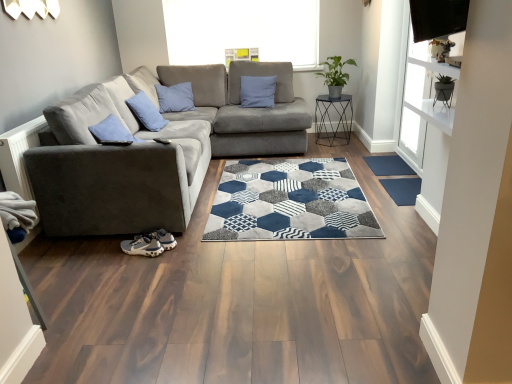
What is the approximate height of blue fabric pillow at center?

blue fabric pillow at center is 15.41 inches in height.

Describe the element at coordinates (434, 36) in the screenshot. I see `transparent glass window screen at upper right` at that location.

Find the location of a particular element. The width and height of the screenshot is (512, 384). blue textured mat at right, which appears as the 1th doormat when ordered from the bottom is located at coordinates (402, 190).

What do you see at coordinates (143, 246) in the screenshot?
I see `gray suede sneaker at lower left` at bounding box center [143, 246].

Locate an element on the screen. The image size is (512, 384). metallic black side table at center is located at coordinates (333, 120).

Does point (395, 171) appear closer or farther from the camera than point (331, 58)?

Clearly, point (395, 171) is closer to the camera than point (331, 58).

Could you measure the distance between dark blue rubber mat at lower right, the 1th doormat viewed from the top, and green matte plant at upper right?

dark blue rubber mat at lower right, the 1th doormat viewed from the top, is 4.15 feet away from green matte plant at upper right.

You are a GUI agent. You are given a task and a screenshot of the screen. Output one action in this format:
    pyautogui.click(x=<x>, y=<y>)
    Task: Click on the plant that is above the dark blue rubber mat at lower right, the 1th doormat viewed from the top (from the image's perspective)
    
    Given the screenshot: What is the action you would take?
    pyautogui.click(x=335, y=75)

Locate an element on the screen. This screenshot has width=512, height=384. pillow that appears above the blue textured mat at right, positioned as the second doormat in top-to-bottom order (from the image's perspective) is located at coordinates (146, 112).

Based on the photo, from a real-world perspective, is blue fabric pillow at center located higher than blue textured mat at right, the 2th doormat when ordered from back to front?

Yes, from a real-world perspective, blue fabric pillow at center is on top of blue textured mat at right, the 2th doormat when ordered from back to front.

Can you confirm if gray fabric couch at left is shorter than green matte plant at upper right?

No.

Can you confirm if gray fabric couch at left is smaller than green matte plant at upper right?

No.

Does gray fabric couch at left lie in front of green matte plant at upper right?

Yes, the depth of gray fabric couch at left is less than that of green matte plant at upper right.

Is gray fabric couch at left far from green matte plant at upper right?

Yes, gray fabric couch at left and green matte plant at upper right are quite far apart.

Which of these two, blue fabric pillow at center or metallic black side table at center, stands shorter?

blue fabric pillow at center.

This screenshot has height=384, width=512. Identify the location of pillow that appears in front of the metallic black side table at center. (146, 112).

Consider the image. Considering the relative sizes of blue fabric pillow at center and metallic black side table at center in the image provided, is blue fabric pillow at center thinner than metallic black side table at center?

Indeed, blue fabric pillow at center has a lesser width compared to metallic black side table at center.

Which is correct: blue fabric pillow at center is inside metallic black side table at center, or outside of it?

blue fabric pillow at center lies outside metallic black side table at center.

Between point (402, 192) and point (142, 109), which one is positioned behind?

The point (142, 109) is behind.

From the image's perspective, is blue textured mat at right, positioned as the second doormat in top-to-bottom order, over blue fabric pillow at center?

No, from the image's perspective, blue textured mat at right, positioned as the second doormat in top-to-bottom order, is not over blue fabric pillow at center.

How different are the orientations of blue textured mat at right, which appears as the 1th doormat when ordered from the bottom, and blue fabric pillow at center in degrees?

They differ by 0.978 degrees in their facing directions.

Which of these two, blue textured mat at right, the 2th doormat when ordered from back to front, or blue fabric pillow at center, is smaller?

With smaller size is blue textured mat at right, the 2th doormat when ordered from back to front.

Is green matte plant at upper right directly adjacent to blue textured mat at right, the 2th doormat when ordered from back to front?

green matte plant at upper right and blue textured mat at right, the 2th doormat when ordered from back to front, are not in contact.

Is green matte plant at upper right shorter than blue textured mat at right, the 1th doormat from the front?

Incorrect, the height of green matte plant at upper right does not fall short of that of blue textured mat at right, the 1th doormat from the front.

Based on the photo, from a real-world perspective, is green matte plant at upper right under blue textured mat at right, positioned as the second doormat in top-to-bottom order?

No.

Which is more to the right, green matte plant at upper right or blue textured mat at right, positioned as the second doormat in top-to-bottom order?

blue textured mat at right, positioned as the second doormat in top-to-bottom order.

From the image's perspective, does velvet grey couch at center appear higher than gray suede sneaker at lower left?

Correct, velvet grey couch at center appears higher than gray suede sneaker at lower left in the image.

Is velvet grey couch at center next to gray suede sneaker at lower left?

No.

This screenshot has width=512, height=384. Find the location of `footwear below the velvet grey couch at center (from the image's perspective)`. footwear below the velvet grey couch at center (from the image's perspective) is located at coordinates (143, 246).

Considering the relative sizes of velvet grey couch at center and gray suede sneaker at lower left in the image provided, is velvet grey couch at center shorter than gray suede sneaker at lower left?

No.

You are a GUI agent. You are given a task and a screenshot of the screen. Output one action in this format:
    pyautogui.click(x=<x>, y=<y>)
    Task: Click on the plant above the dark blue rubber mat at lower right, placed as the 2th doormat when sorted from bottom to top (from a real-world perspective)
    
    Given the screenshot: What is the action you would take?
    pyautogui.click(x=335, y=75)

Find the location of a particular element. Image resolution: width=512 pixels, height=384 pixels. doormat that is the 1st object to the right of the blue fabric pillow at center, starting at the anchor is located at coordinates coord(402,190).

In the scene shown: When comparing their distances from blue fabric pillow at center, does gray fabric couch at left or velvet grey couch at center seem closer?

gray fabric couch at left is positioned closer to the anchor blue fabric pillow at center.

From the image, which object appears to be nearer to metallic black side table at center, velvet grey couch at center or green matte plant at upper right?

green matte plant at upper right.

In the scene shown: Looking at the image, which one is located further to transparent glass window screen at upper right, blue textured mat at right, the 2th doormat when ordered from back to front, or velvet grey couch at center?

Among the two, velvet grey couch at center is located further to transparent glass window screen at upper right.

Looking at the image, which one is located further to transparent glass window screen at upper right, gray suede sneaker at lower left or velvet grey couch at center?

gray suede sneaker at lower left is positioned further to the anchor transparent glass window screen at upper right.

Estimate the real-world distances between objects in this image. Which object is closer to gray suede sneaker at lower left, dark blue rubber mat at lower right, which ranks as the 2th doormat in front-to-back order, or velvet grey couch at center?

Based on the image, velvet grey couch at center appears to be nearer to gray suede sneaker at lower left.

When comparing their distances from transparent glass window screen at upper right, does metallic black side table at center or blue textured mat at right, the 1th doormat from the front, seem further?

Among the two, metallic black side table at center is located further to transparent glass window screen at upper right.

Based on their spatial positions, is dark blue rubber mat at lower right, which ranks as the 2th doormat in front-to-back order, or blue fabric pillow at center closer to gray suede sneaker at lower left?

blue fabric pillow at center lies closer to gray suede sneaker at lower left than the other object.

Considering their positions, is blue fabric pillow at center positioned further to dark blue rubber mat at lower right, placed as the 2th doormat when sorted from bottom to top, than gray suede sneaker at lower left?

Based on the image, gray suede sneaker at lower left appears to be further to dark blue rubber mat at lower right, placed as the 2th doormat when sorted from bottom to top.

The image size is (512, 384). I want to click on furniture located between velvet grey couch at center and blue textured mat at right, positioned as the second doormat in top-to-bottom order, in the left-right direction, so click(x=333, y=120).

This screenshot has width=512, height=384. I want to click on plant between blue fabric pillow at center and transparent glass window screen at upper right, so click(335, 75).

Identify the location of couch between gray fabric couch at left and metallic black side table at center from front to back. (243, 109).

Find the location of a particular element. furniture between gray suede sneaker at lower left and dark blue rubber mat at lower right, marked as the first doormat in a back-to-front arrangement, from left to right is located at coordinates (333, 120).